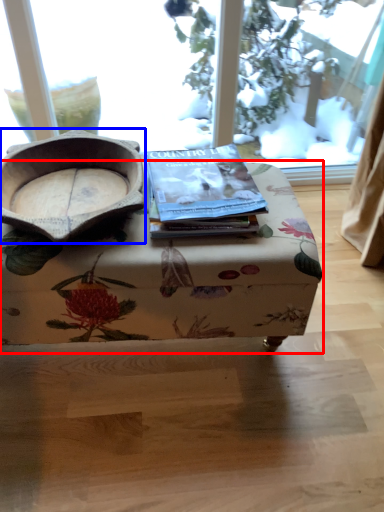
Question: Among these objects, which one is farthest to the camera, table (highlighted by a red box) or bowl (highlighted by a blue box)?

Choices:
 (A) table
 (B) bowl

Answer: (A)